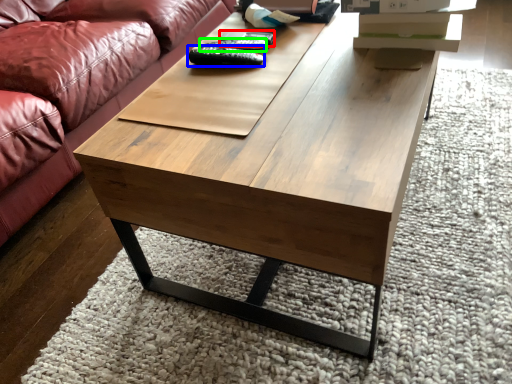
Question: Considering the real-world distances, which object is farthest from remote (highlighted by a red box)? remote (highlighted by a blue box) or remote (highlighted by a green box)?

Choices:
 (A) remote
 (B) remote

Answer: (A)